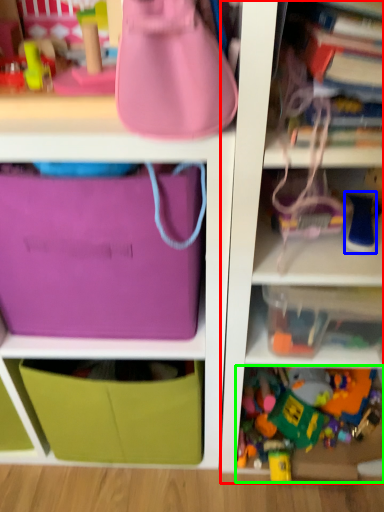
Question: Considering the real-world distances, which object is farthest from shelf (highlighted by a red box)? toy (highlighted by a blue box) or toy (highlighted by a green box)?

Choices:
 (A) toy
 (B) toy

Answer: (A)